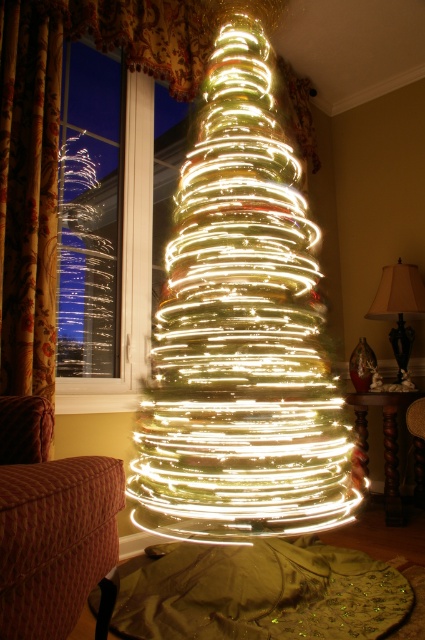
Looking at this image, you are a delivery robot with a package that is 24 inches wide. You need to move from the entrance to the illuminated wire at center. There is a transparent glass window at upper left in your path. Can you pass through the space between them?

The distance between the illuminated wire at center and transparent glass window at upper left is 23.08 inches, which is narrower than the robot and its 24 inches wide package. Therefore, the robot cannot pass through the space between them.

You are a delivery robot that needs to navigate through the room to deliver a package. You see the illuminated wire at center and the transparent glass window at upper left. Which object is wider in the image?

The illuminated wire at center is wider than the transparent glass window at upper left according to the description.